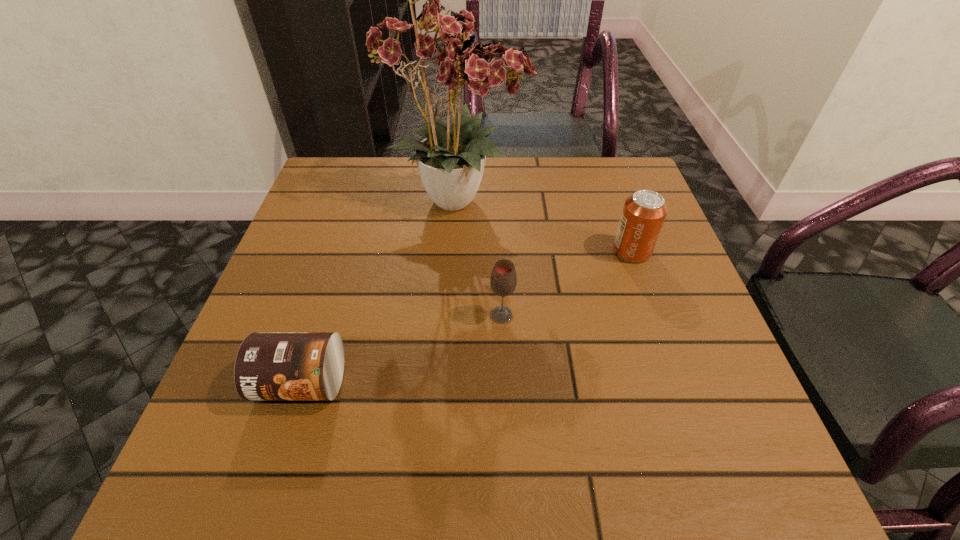
The image size is (960, 540). Find the location of `vacant space located 0.120m on the front label of the shortest object`. vacant space located 0.120m on the front label of the shortest object is located at coordinates (267, 492).

Locate an element on the screen. object that is at the far edge is located at coordinates (443, 50).

Identify the location of object present at the left edge. The width and height of the screenshot is (960, 540). (269, 365).

Image resolution: width=960 pixels, height=540 pixels. I want to click on object present at the right edge, so (x=644, y=212).

Where is `vacant region at the far edge of the desktop`? vacant region at the far edge of the desktop is located at coordinates (400, 207).

The width and height of the screenshot is (960, 540). I want to click on vacant space at the near edge, so click(x=408, y=494).

This screenshot has height=540, width=960. In the image, there is a desktop. What are the coordinates of `blank space at the left edge` in the screenshot? It's located at (353, 266).

Image resolution: width=960 pixels, height=540 pixels. I want to click on free point at the right edge, so click(x=603, y=261).

Locate an element on the screen. This screenshot has height=540, width=960. vacant space at the far left corner of the desktop is located at coordinates (359, 174).

Image resolution: width=960 pixels, height=540 pixels. Find the location of `free space at the near right corner of the desktop`. free space at the near right corner of the desktop is located at coordinates (x=664, y=449).